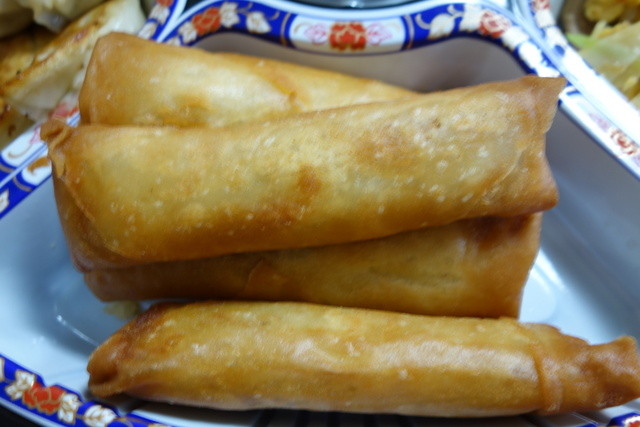
Identify the location of dish. (593, 221), (605, 87), (371, 2), (22, 148).